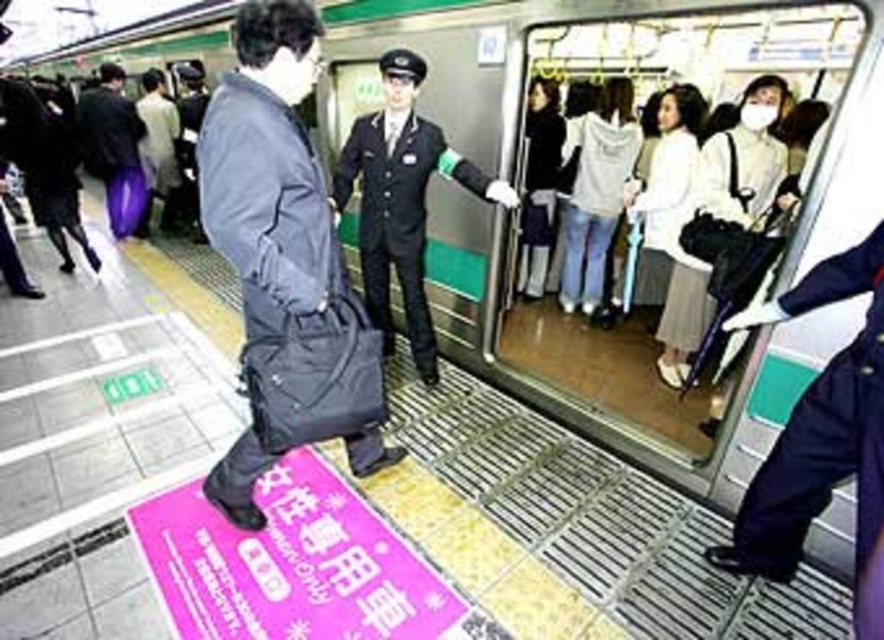
Measure the distance from black uniform at center to purple fabric bag at left.

black uniform at center is 13.58 feet from purple fabric bag at left.

Between black uniform at center and purple fabric bag at left, which one is positioned higher?

purple fabric bag at left is higher up.

The width and height of the screenshot is (884, 640). Describe the element at coordinates (401, 200) in the screenshot. I see `black uniform at center` at that location.

Find the location of a particular element. This screenshot has width=884, height=640. black uniform at center is located at coordinates (401, 200).

Looking at this image, does matte black bag at center appear on the right side of purple fabric bag at left?

Correct, you'll find matte black bag at center to the right of purple fabric bag at left.

Between matte black bag at center and purple fabric bag at left, which one is positioned higher?

purple fabric bag at left is above.

In the scene shown: Who is more forward, (294, 422) or (122, 202)?

Positioned in front is point (294, 422).

Where is `matte black bag at center`? matte black bag at center is located at coordinates (284, 262).

Which is behind, point (257, 252) or point (416, 125)?

The point (416, 125) is behind.

Which is in front, point (221, 161) or point (498, 193)?

Positioned in front is point (221, 161).

Which is behind, point (288, 296) or point (446, 164)?

The point (446, 164) is more distant.

What are the coordinates of `matte black bag at center` in the screenshot? It's located at (284, 262).